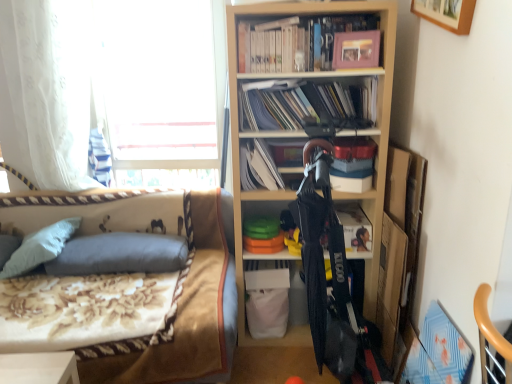
In order to click on blank area beneath white sheer curtain at left (from a real-world perspective) in this screenshot , I will do `click(66, 195)`.